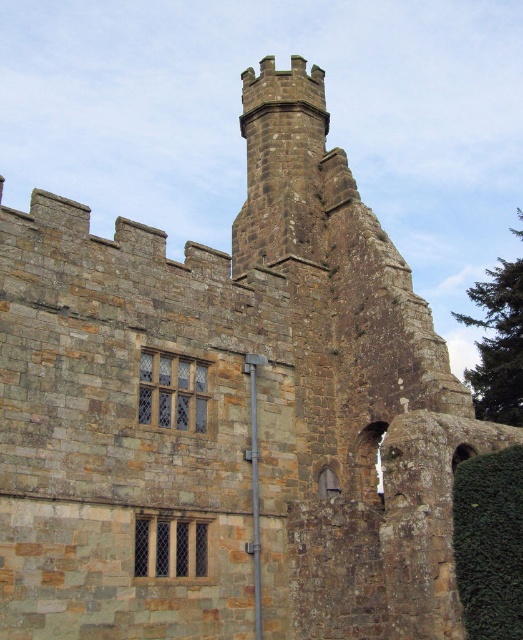
Question: Among these objects, which one is farthest from the camera?

Choices:
 (A) green leafy ivy at right
 (B) green leafy ivy at lower right

Answer: (A)

Question: Can you confirm if green leafy ivy at lower right is positioned to the right of green leafy ivy at right?

Choices:
 (A) no
 (B) yes

Answer: (A)

Question: Which point is farther from the camera taking this photo?

Choices:
 (A) (498, 291)
 (B) (458, 586)

Answer: (A)

Question: Is green leafy ivy at lower right positioned behind green leafy ivy at right?

Choices:
 (A) yes
 (B) no

Answer: (B)

Question: Can you confirm if green leafy ivy at lower right is positioned above green leafy ivy at right?

Choices:
 (A) yes
 (B) no

Answer: (B)

Question: Which object appears closest to the camera in this image?

Choices:
 (A) green leafy ivy at right
 (B) green leafy ivy at lower right

Answer: (B)